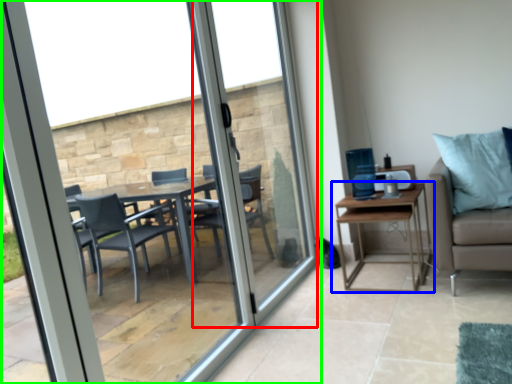
Question: Which is nearer to the screen door (highlighted by a red box)? table (highlighted by a blue box) or window (highlighted by a green box).

Choices:
 (A) table
 (B) window

Answer: (B)